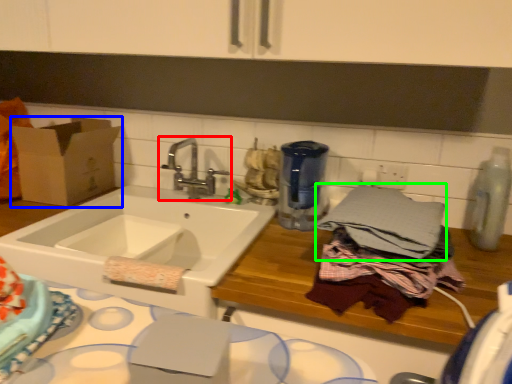
Question: Estimate the real-world distances between objects in this image. Which object is farther from tap (highlighted by a red box), cardboard box (highlighted by a blue box) or bath towel (highlighted by a green box)?

Choices:
 (A) cardboard box
 (B) bath towel

Answer: (B)